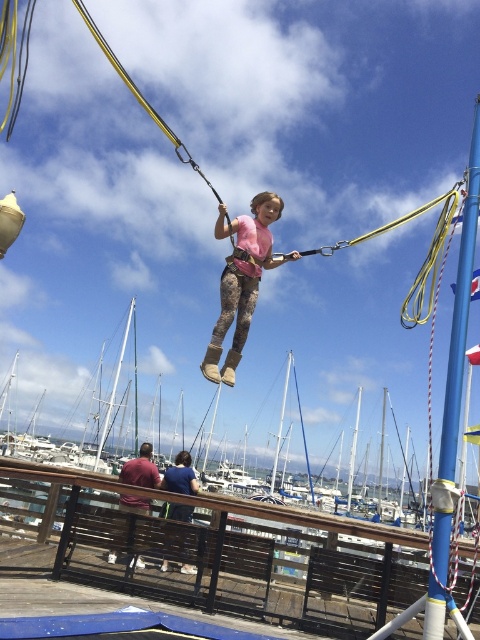
You are a safety inspector checking the distance between the blue painted metal pole at right and the camouflage leggings at center. According to safety regulations, the minimum safe distance between any equipment and people should be at least 3 meters. Is the current distance compliant with the regulations?

The blue painted metal pole at right is 2.59 meters away from the camouflage leggings at center. Since 2.59 meters is less than the required 3 meters, the current distance does not comply with the safety regulations.

You are standing at the very front of the marina and want to reach the brown wooden dock at lower center. Which direction should you walk to get there?

Since the brown wooden dock at lower center is located at point 0.870 on the x axis and 0.450 on the y axis, you should walk towards the right and slightly forward to reach it.

You are a photographer trying to capture a clear shot of the blue painted metal pole at right and the camouflage leggings at center. From your current position, can you see both objects without any obstruction?

The blue painted metal pole at right is in front of the camouflage leggings at center, so the pole may block part of the leggings, making it difficult to capture both clearly without moving your position.